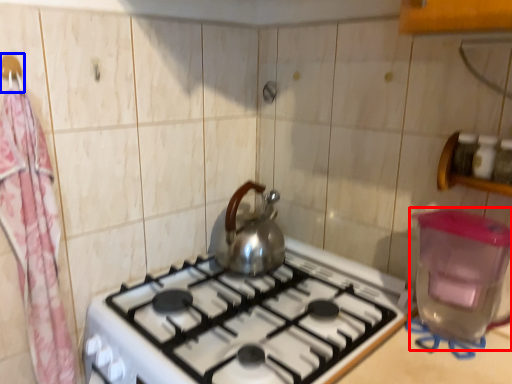
Question: Which point is closer to the camera, water heater (highlighted by a red box) or hanger (highlighted by a blue box)?

Choices:
 (A) water heater
 (B) hanger

Answer: (A)